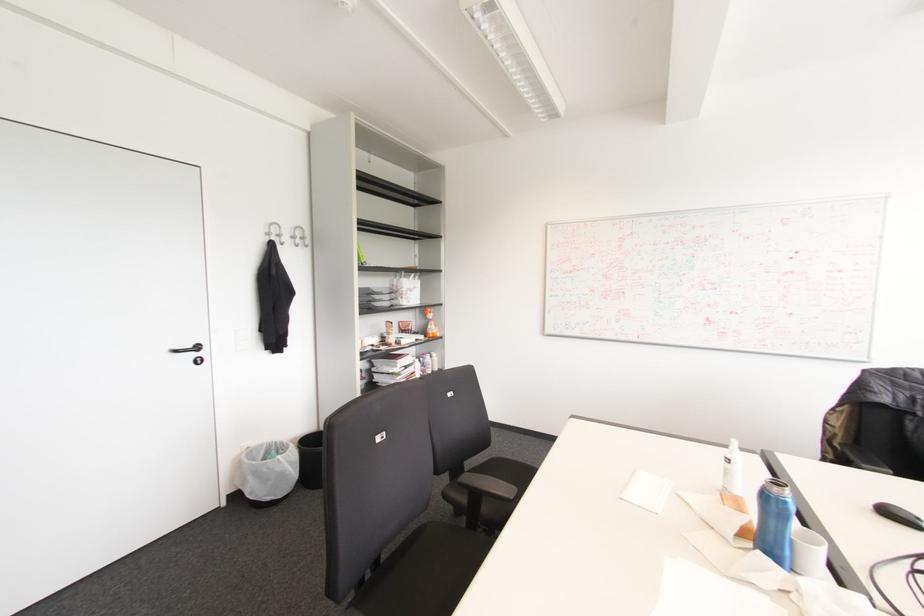
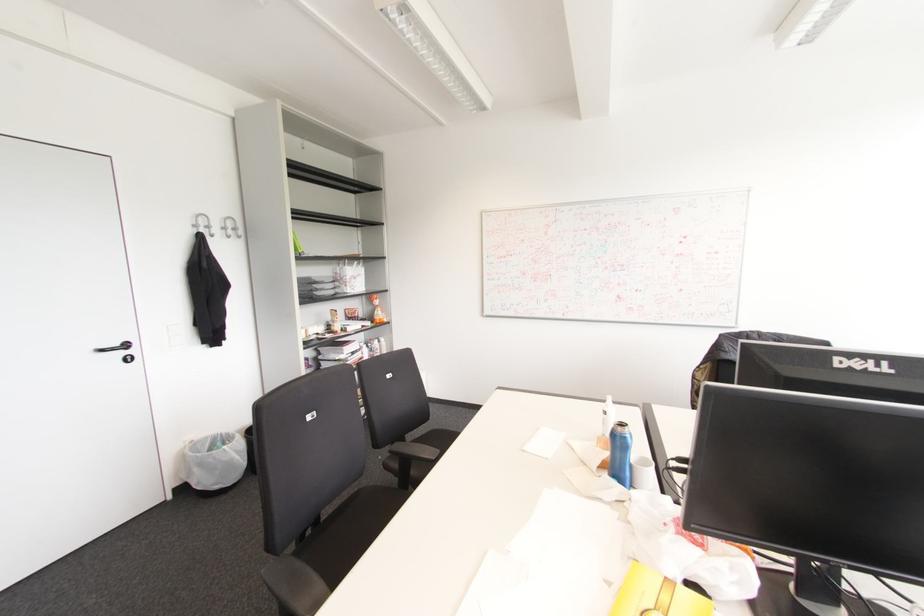
Where in the second image is the point corresponding to [249,477] from the first image?

(195, 469)